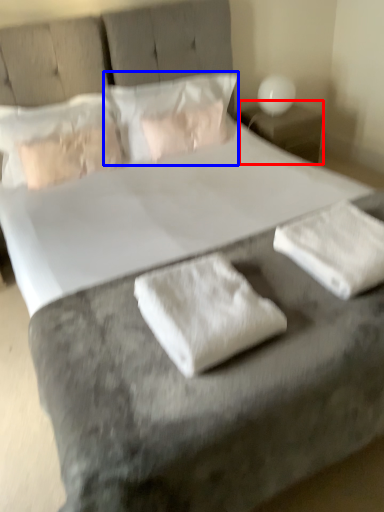
Question: Among these objects, which one is nearest to the camera, nightstand (highlighted by a red box) or pillow (highlighted by a blue box)?

Choices:
 (A) nightstand
 (B) pillow

Answer: (B)